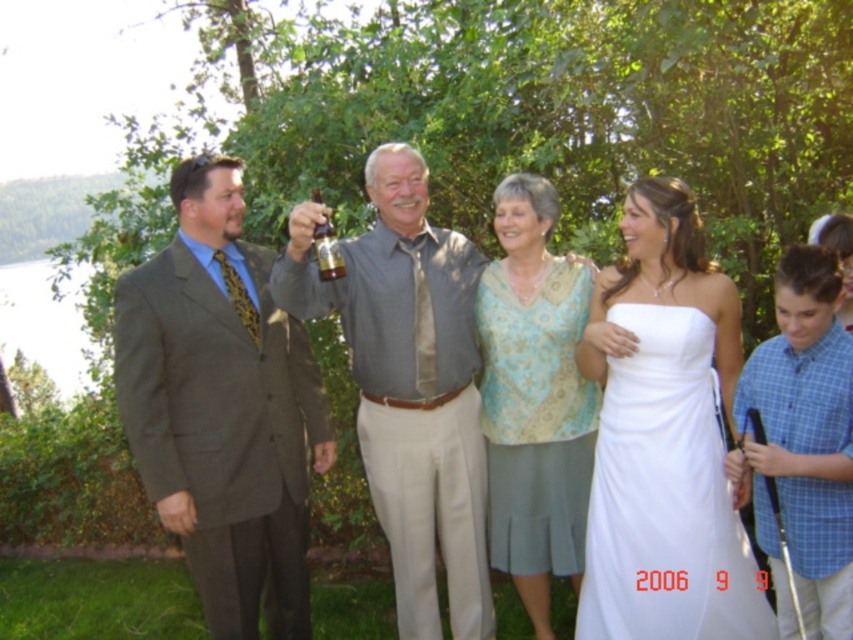
Question: Does white satin dress at right lie in front of gold glass bottle at center?

Choices:
 (A) yes
 (B) no

Answer: (A)

Question: Is matte brown suit at left smaller than gold glass bottle at center?

Choices:
 (A) yes
 (B) no

Answer: (B)

Question: Among these objects, which one is nearest to the camera?

Choices:
 (A) light blue patterned blouse at center
 (B) matte brown suit at left
 (C) gold glass bottle at center

Answer: (C)

Question: Which point appears closest to the camera in this image?

Choices:
 (A) (227, 531)
 (B) (531, 547)
 (C) (640, 493)
 (D) (421, 248)

Answer: (C)

Question: Is white satin dress at right above gold glass bottle at center?

Choices:
 (A) no
 (B) yes

Answer: (A)

Question: Which point is farther to the camera?

Choices:
 (A) gray shirt at center
 (B) light blue patterned blouse at center
 (C) matte brown suit at left

Answer: (B)